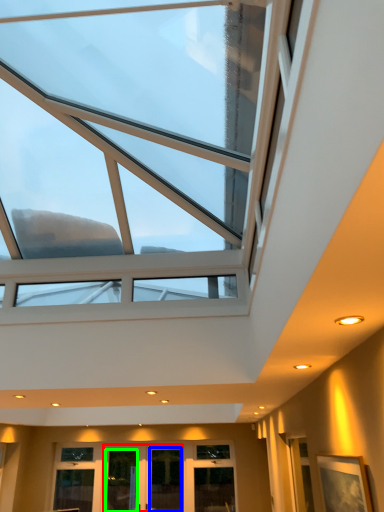
Question: Estimate the real-world distances between objects in this image. Which object is closer to glass door (highlighted by a red box), glass door (highlighted by a blue box) or glass door (highlighted by a green box)?

Choices:
 (A) glass door
 (B) glass door

Answer: (B)